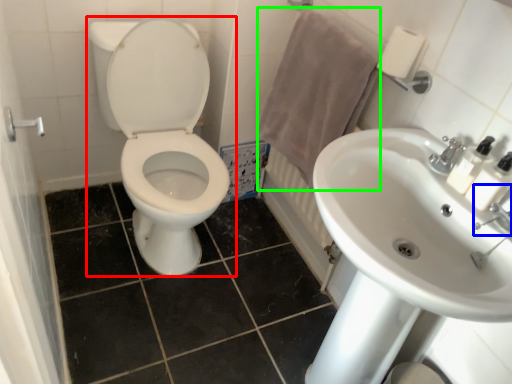
Question: Considering the real-world distances, which object is closest to toilet (highlighted by a red box)? plumbing fixture (highlighted by a blue box) or bath towel (highlighted by a green box).

Choices:
 (A) plumbing fixture
 (B) bath towel

Answer: (B)